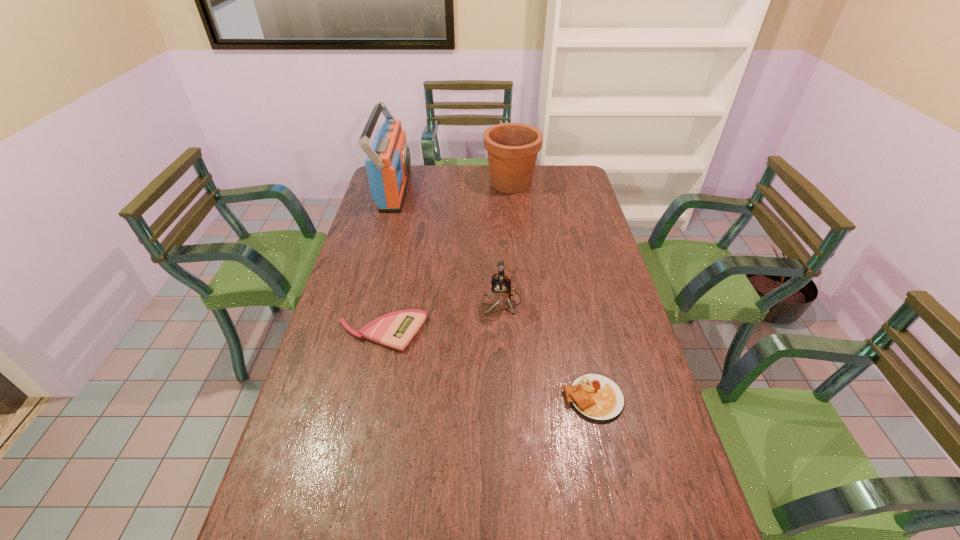
Find the location of `free space between the fourth shortest object and the third shortest object`. free space between the fourth shortest object and the third shortest object is located at coordinates (507, 242).

Locate an element on the screen. vacant area that lies between the second nearest object and the radio receiver is located at coordinates (388, 262).

The width and height of the screenshot is (960, 540). I want to click on vacant area that lies between the nearest object and the wristlet, so click(x=488, y=366).

The width and height of the screenshot is (960, 540). Identify the location of unoccupied position between the radio receiver and the earphone. (448, 246).

Point out which object is positioned as the nearest to the third shortest object. Please provide its 2D coordinates. Your answer should be formatted as a tuple, i.e. [(x, y)], where the tuple contains the x and y coordinates of a point satisfying the conditions above.

[(396, 329)]

Locate an element on the screen. This screenshot has height=540, width=960. object that is the closest to the second nearest object is located at coordinates (501, 286).

Locate an element on the screen. The width and height of the screenshot is (960, 540). free region that satisfies the following two spatial constraints: 1. on the front-facing side of the omelet; 2. on the left side of the radio receiver is located at coordinates (337, 398).

Where is `vacant position in the image that satisfies the following two spatial constraints: 1. on the back side of the second tallest object; 2. on the left side of the fourth farthest object`? The height and width of the screenshot is (540, 960). vacant position in the image that satisfies the following two spatial constraints: 1. on the back side of the second tallest object; 2. on the left side of the fourth farthest object is located at coordinates (414, 183).

Where is `free space that satisfies the following two spatial constraints: 1. on the back side of the omelet; 2. on the front-facing side of the tallest object`? free space that satisfies the following two spatial constraints: 1. on the back side of the omelet; 2. on the front-facing side of the tallest object is located at coordinates (548, 190).

Image resolution: width=960 pixels, height=540 pixels. I want to click on vacant space that satisfies the following two spatial constraints: 1. on the front-facing side of the radio receiver; 2. on the back side of the omelet, so click(x=337, y=398).